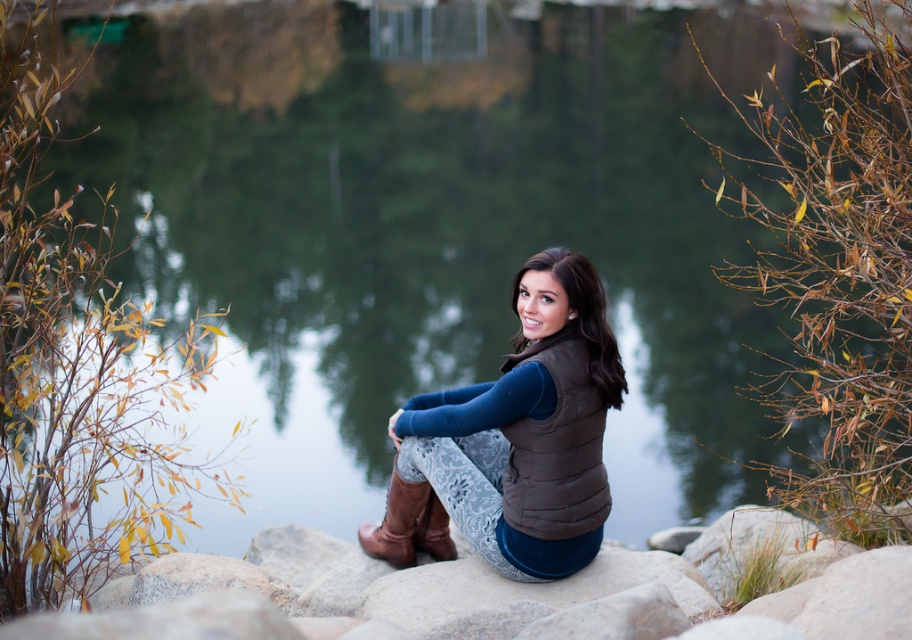
Question: Is brown textured stone at center smaller than brown leather boot at lower center?

Choices:
 (A) yes
 (B) no

Answer: (B)

Question: Which point is closer to the camera?

Choices:
 (A) (506, 448)
 (B) (427, 506)
 (C) (364, 616)

Answer: (C)

Question: Does brown textured stone at center appear on the right side of brown leather boot at lower center?

Choices:
 (A) yes
 (B) no

Answer: (A)

Question: Based on their relative distances, which object is farther from the brown leather boot at lower center?

Choices:
 (A) brown quilted vest at center
 (B) brown textured stone at center

Answer: (A)

Question: Which point is closer to the camera?

Choices:
 (A) brown quilted vest at center
 (B) brown leather boot at lower center
 (C) brown textured stone at center

Answer: (C)

Question: Is brown textured stone at center positioned at the back of brown leather boot at lower center?

Choices:
 (A) yes
 (B) no

Answer: (B)